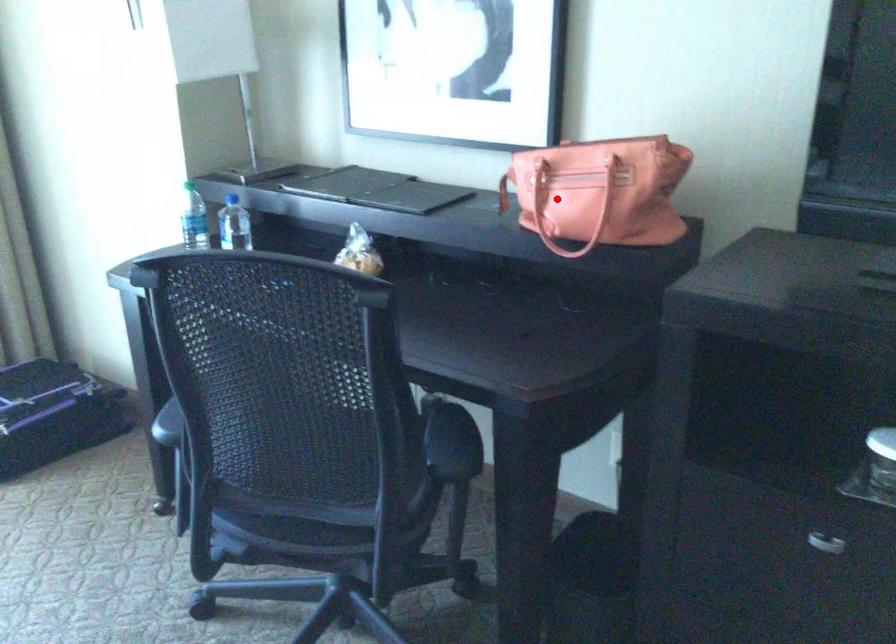
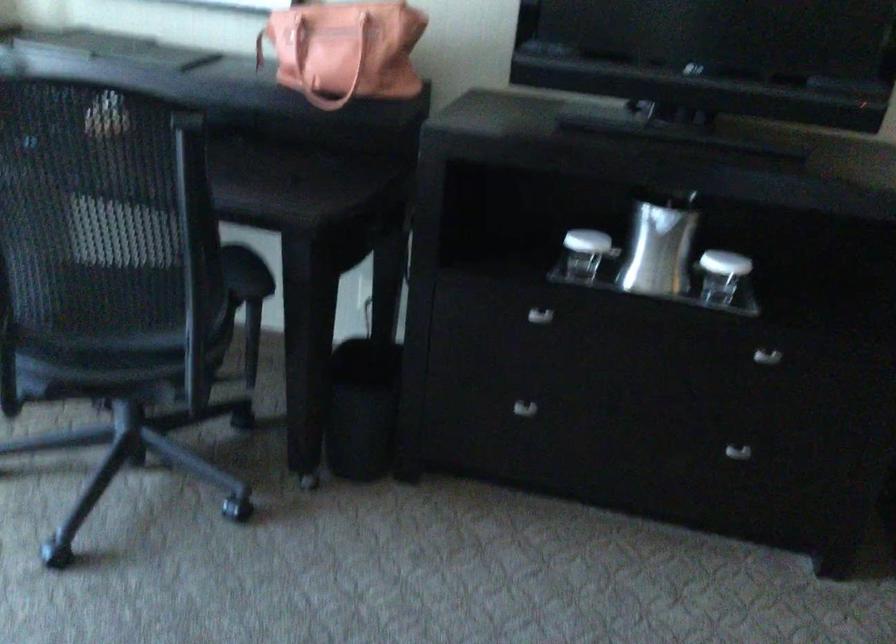
Question: I am providing you with two images of the same scene from different viewpoints. A red point is shown in image1. For the corresponding object point in image2, is it positioned nearer or farther from the camera?

Choices:
 (A) Nearer
 (B) Farther

Answer: (B)